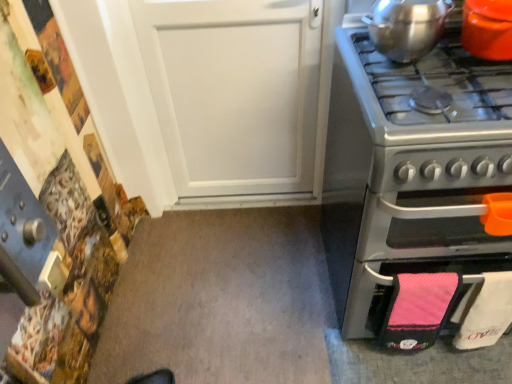
Identify the location of vacant space that is in between shiny metallic pot at upper right, positioned as the 2th kitchen appliance in right-to-left order, and orange glossy pot at upper right, which ranks as the second kitchen appliance in left-to-right order. coord(440,58).